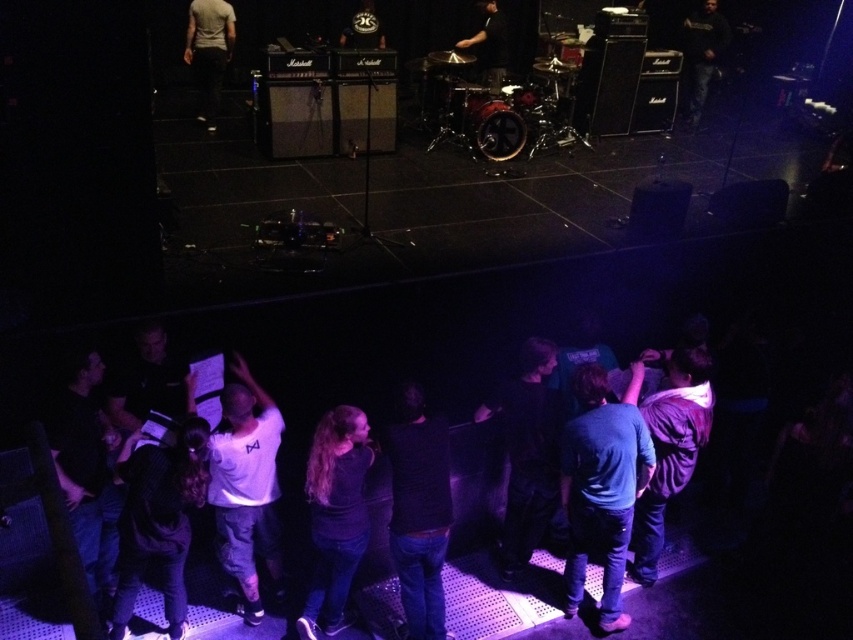
You are standing at the center of the stage and want to move towards the blue denim jeans at lower right. Which direction should you head?

The blue denim jeans at lower right is located at point (601, 490), so you should move towards the lower right direction from the center of the stage.

You are a photographer at the live music performance. You need to capture a photo that includes both the dark blue jeans at center and the white matte shirt at upper left. Considering their widths, which one should you zoom in on more to ensure both fit in the frame?

Since the dark blue jeans at center is narrower than the white matte shirt at upper left, you should zoom in more on the white matte shirt at upper left to ensure both fit in the frame.

Looking at this image, you are a photographer at the concert and want to capture a photo of the drummer. You notice the dark gray hoodie at upper right and the dark brown leather drumsticks at upper center in your viewfinder. Which object should you focus on to ensure the drummer is in the foreground?

The dark gray hoodie at upper right is located below the dark brown leather drumsticks at upper center. To focus on the drummer in the foreground, you should adjust your focus to the dark gray hoodie at upper right since it is closer to the camera.